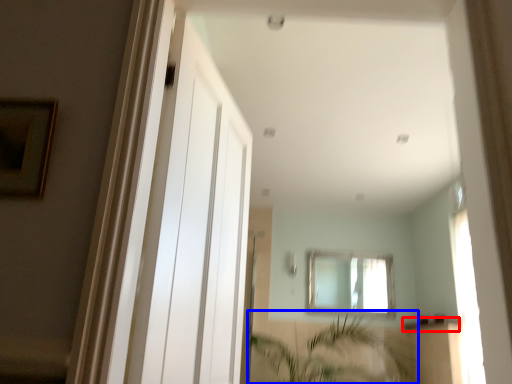
Question: Among these objects, which one is nearest to the camera, window sill (highlighted by a red box) or vegetation (highlighted by a blue box)?

Choices:
 (A) window sill
 (B) vegetation

Answer: (B)